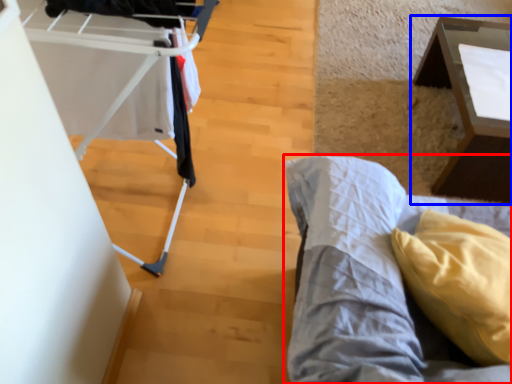
Question: Which point is further to the camera, furniture (highlighted by a red box) or table (highlighted by a blue box)?

Choices:
 (A) furniture
 (B) table

Answer: (B)